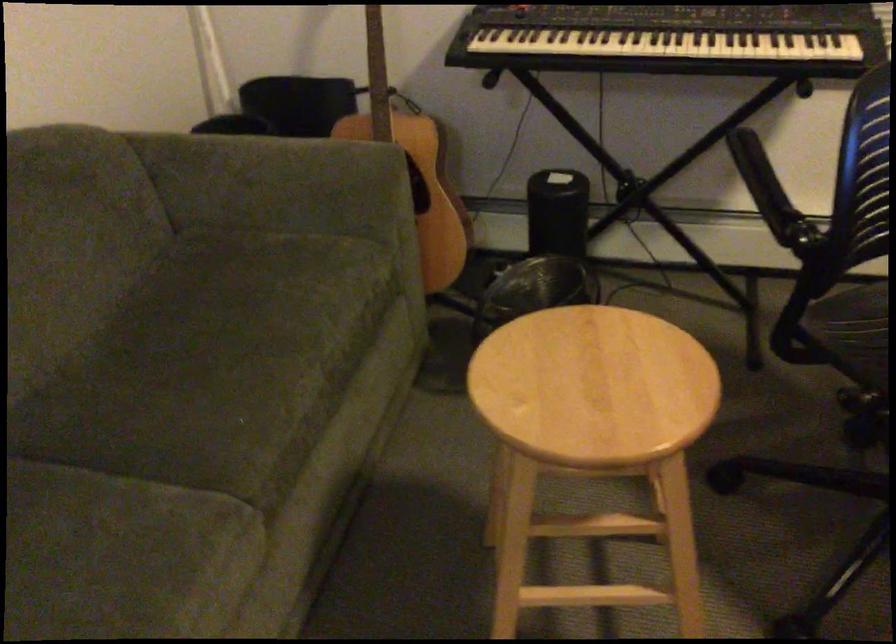
This screenshot has width=896, height=644. What do you see at coordinates (211, 351) in the screenshot?
I see `the green sofa sitting surface` at bounding box center [211, 351].